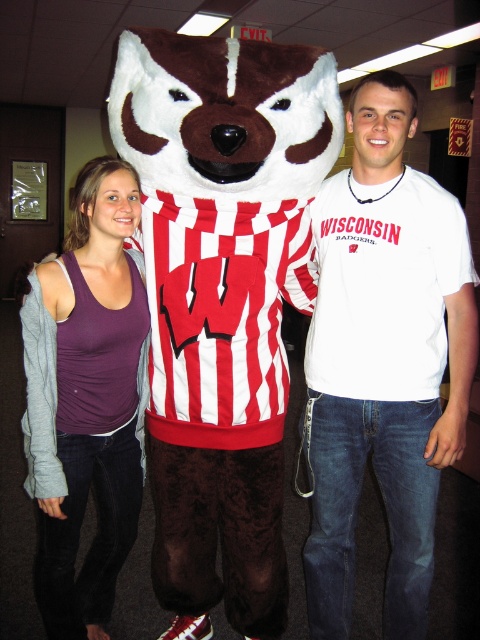
You are a photographer standing 2 meters away from the brown plush badger at center. You want to take a closeup photo of the mascot. If your camera has a minimum focusing distance of 1.5 meters, will you need to move closer or farther away?

The minimum focusing distance is 1.5 meters, but you are currently 2 meters away from the brown plush badger at center. To take a closeup photo, you need to move closer to the brown plush badger at center until you are within 1.5 meters.